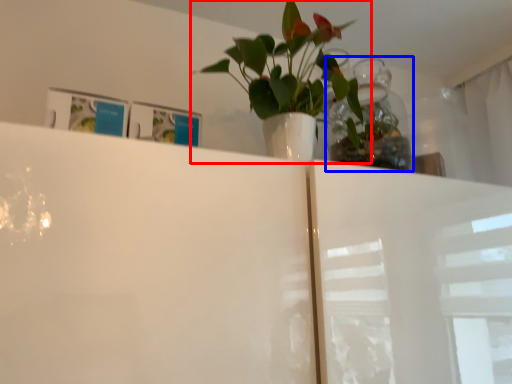
Question: Which object is further to the camera taking this photo, houseplant (highlighted by a red box) or glass vase (highlighted by a blue box)?

Choices:
 (A) houseplant
 (B) glass vase

Answer: (B)